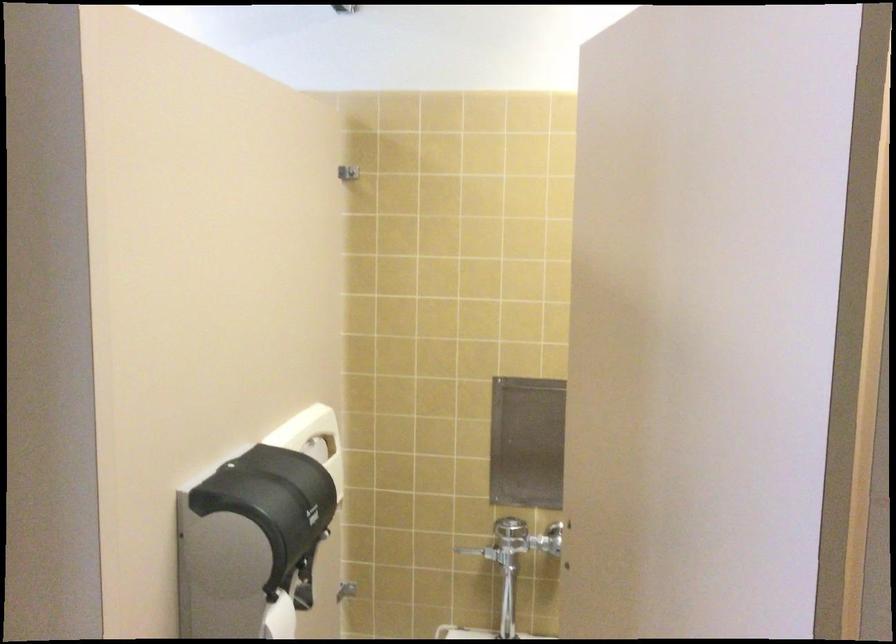
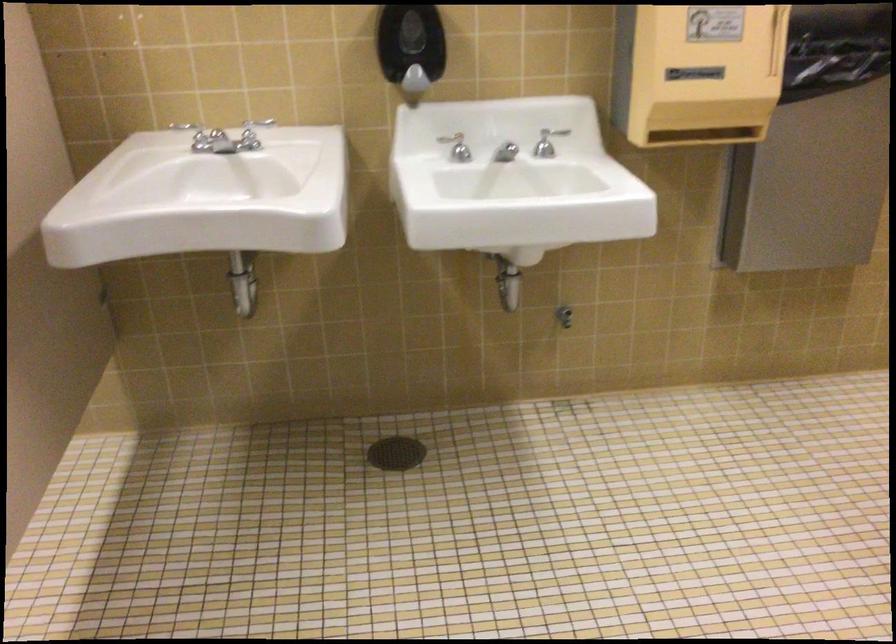
Question: Which direction would the cameraman need to move to produce the second image? Reply with the corresponding letter.

Choices:
 (A) Left
 (B) Right
 (C) Forward
 (D) Backward

Answer: (B)